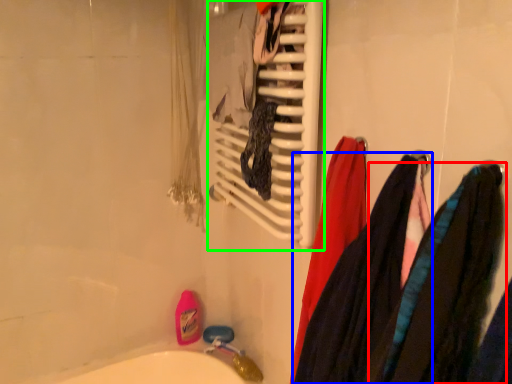
Question: Which object is the closest to the clothing (highlighted by a red box)? Choose among these: clothing (highlighted by a blue box) or towel rack (highlighted by a green box).

Choices:
 (A) clothing
 (B) towel rack

Answer: (A)